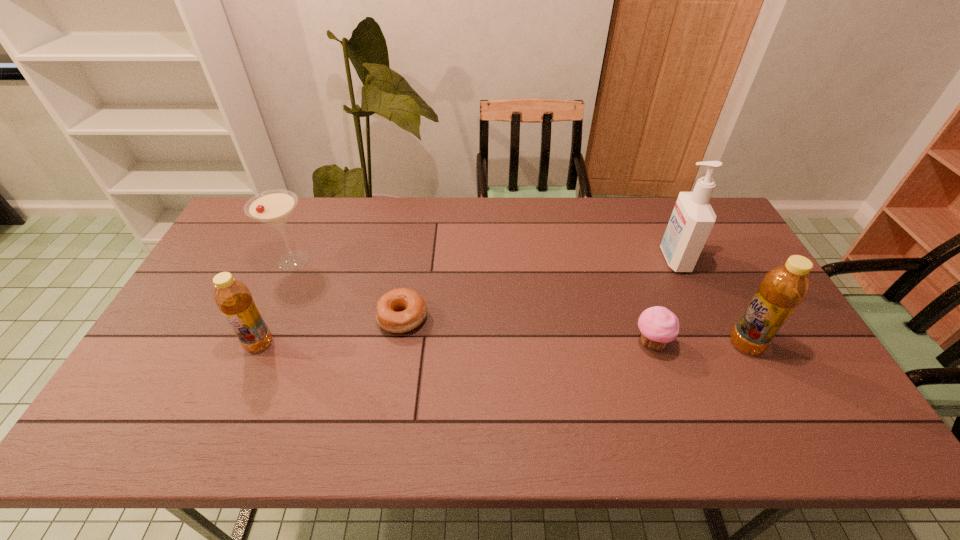
Where is `vacant point located on the back of the second tallest object`? This screenshot has height=540, width=960. vacant point located on the back of the second tallest object is located at coordinates (711, 279).

What are the coordinates of `vacant area located 0.110m on the front label of the cleansing agent` in the screenshot? It's located at (626, 259).

Find the location of a particular element. free spot located on the front label of the cleansing agent is located at coordinates (558, 259).

Where is `free space located 0.260m on the front label of the cleansing agent`? free space located 0.260m on the front label of the cleansing agent is located at coordinates (579, 259).

Identify the location of vacant region located 0.070m on the front of the fourth object from left to right. This screenshot has height=540, width=960. (664, 382).

You are a GUI agent. You are given a task and a screenshot of the screen. Output one action in this format:
    pyautogui.click(x=<x>, y=<y>)
    Task: Click on the vacant space located 0.230m on the back of the martini
    
    Given the screenshot: What is the action you would take?
    pyautogui.click(x=318, y=205)

What are the coordinates of `free region located on the back of the third object from left to right` in the screenshot? It's located at (409, 278).

Identify the location of object positioned at the right edge. The image size is (960, 540). (784, 287).

Image resolution: width=960 pixels, height=540 pixels. In order to click on free space at the far edge of the desktop in this screenshot , I will do `click(292, 216)`.

Find the location of a particular element. The height and width of the screenshot is (540, 960). vacant space at the near edge of the desktop is located at coordinates [x=210, y=382].